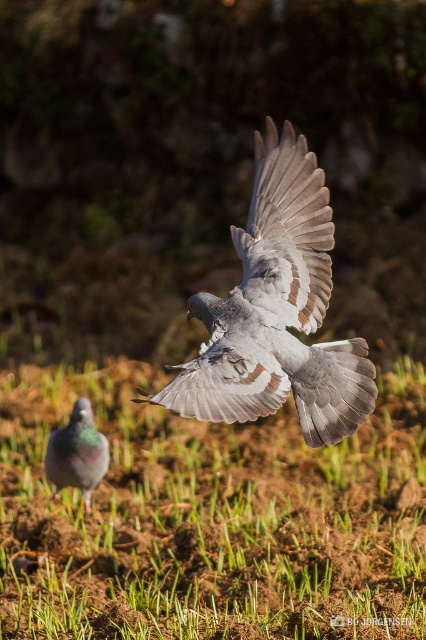
Between white feathered wing at center and gray matte pigeon at lower left, which one is positioned higher?

white feathered wing at center

Describe the element at coordinates (285, 234) in the screenshot. I see `white feathered wing at center` at that location.

Between point (322, 188) and point (48, 445), which one is positioned behind?

The point (48, 445) is behind.

Locate an element on the screen. This screenshot has height=640, width=426. white feathered wing at center is located at coordinates (285, 234).

Who is shorter, green grass at lower center or gray feathered bird at center?

Standing shorter between the two is gray feathered bird at center.

From the picture: Can you confirm if green grass at lower center is positioned to the right of gray feathered bird at center?

Incorrect, green grass at lower center is not on the right side of gray feathered bird at center.

The width and height of the screenshot is (426, 640). What do you see at coordinates (212, 518) in the screenshot?
I see `green grass at lower center` at bounding box center [212, 518].

I want to click on green grass at lower center, so click(212, 518).

Based on the photo, between green grass at lower center and white feathered wing at center, which one appears on the left side from the viewer's perspective?

From the viewer's perspective, green grass at lower center appears more on the left side.

Which of these two, green grass at lower center or white feathered wing at center, stands shorter?

Standing shorter between the two is white feathered wing at center.

Is point (158, 627) more distant than point (262, 305)?

Yes, it is behind point (262, 305).

Where is `green grass at lower center`? This screenshot has height=640, width=426. green grass at lower center is located at coordinates (212, 518).